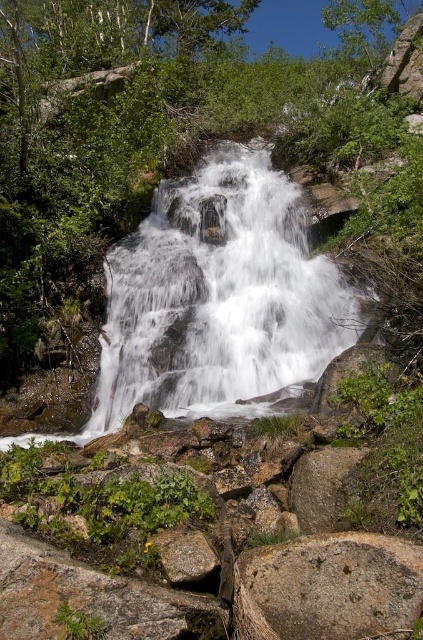
You are a hiker standing at the base of the waterfall. You notice the white frothy water at center and the gray rough rock at lower right. Which object is higher in elevation?

The white frothy water at center is located above the gray rough rock at lower right, so it has a higher elevation.

You are standing at the edge of the waterfall and want to take a photo of the gray rough rock at lower center without the white frothy water at center blocking it. How should you position yourself to achieve this?

The gray rough rock at lower center is behind the white frothy water at center, so you should move to a position where you can see behind the waterfall. This might involve moving to the side or behind the main flow of water to capture the rock without obstruction.

You are a drone operator trying to capture the waterfall. The drone has a camera that can only focus on objects within a 0.1 radius of a specific coordinate. If you want to center the camera on the white frothy water at center, what coordinates should you target?

The white frothy water at center is located at coordinates point (219, 298), so you should target those coordinates to center the camera on it.